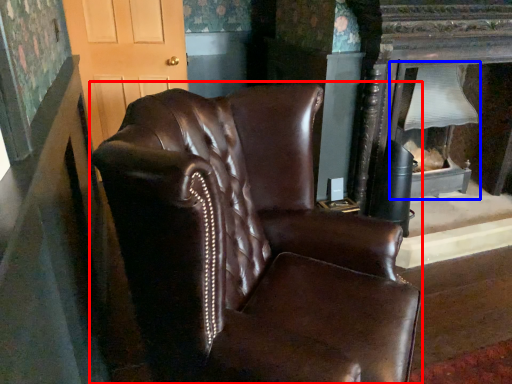
Question: Which of the following is the closest to the observer, chair (highlighted by a red box) or fireplace (highlighted by a blue box)?

Choices:
 (A) chair
 (B) fireplace

Answer: (A)